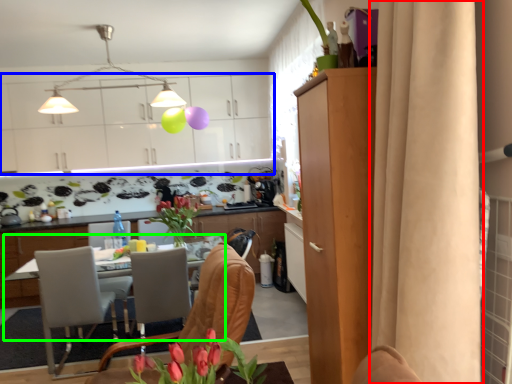
Question: Which object is positioned farthest from curtain (highlighted by a red box)? Select from cabinetry (highlighted by a blue box) and desk (highlighted by a green box).

Choices:
 (A) cabinetry
 (B) desk

Answer: (A)